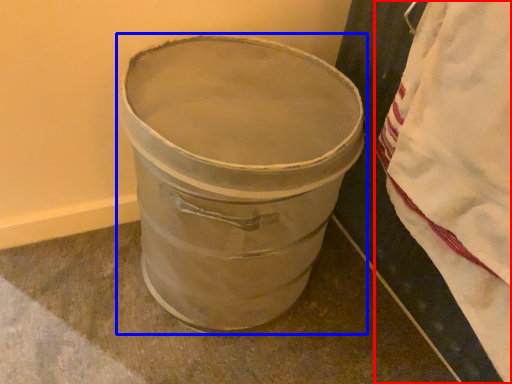
Question: Which object is further to the camera taking this photo, blanket (highlighted by a red box) or waste container (highlighted by a blue box)?

Choices:
 (A) blanket
 (B) waste container

Answer: (B)